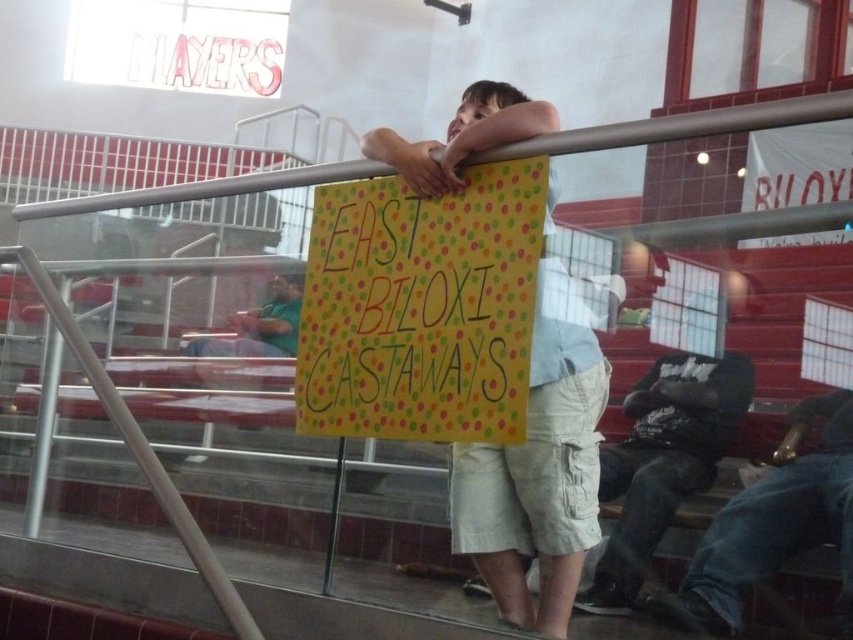
You are standing in the gymnasium and see the point at coordinates (663, 461). Which object is this point located on?

The point at coordinates (663, 461) is located on the dark gray hoodie at lower right.

Where is the light beige shorts at center located in the image?

The light beige shorts at center is located at point (537, 481) in the image.

You are organizing a clothing donation drive and need to categorize items by size. You have a dark gray hoodie at lower right and a green fabric shirt at left. Which item is more likely to fit into a standard small donation box?

The dark gray hoodie at lower right is thinner than the green fabric shirt at left, so it is more likely to fit into a standard small donation box.